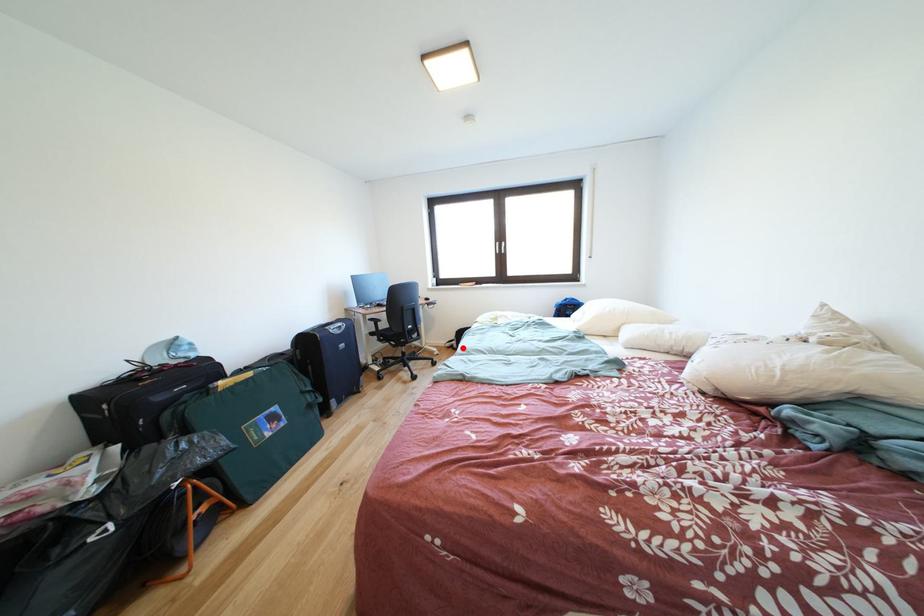
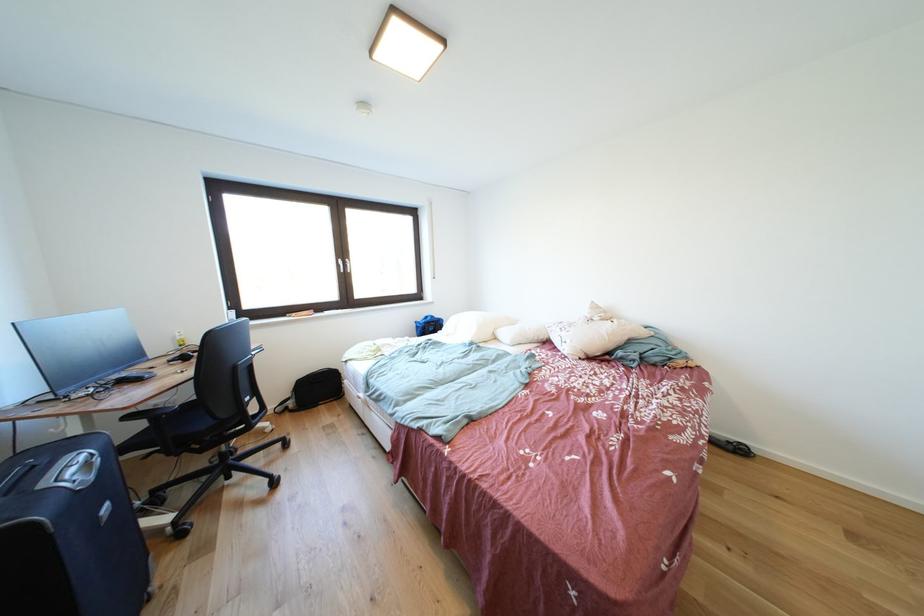
Question: I am providing you with two images of the same scene from different viewpoints. Image1 has a red point marked. In image2, the corresponding 3D location appears at what relative position? Reply with the corresponding letter.

Choices:
 (A) Closer
 (B) Farther

Answer: (A)